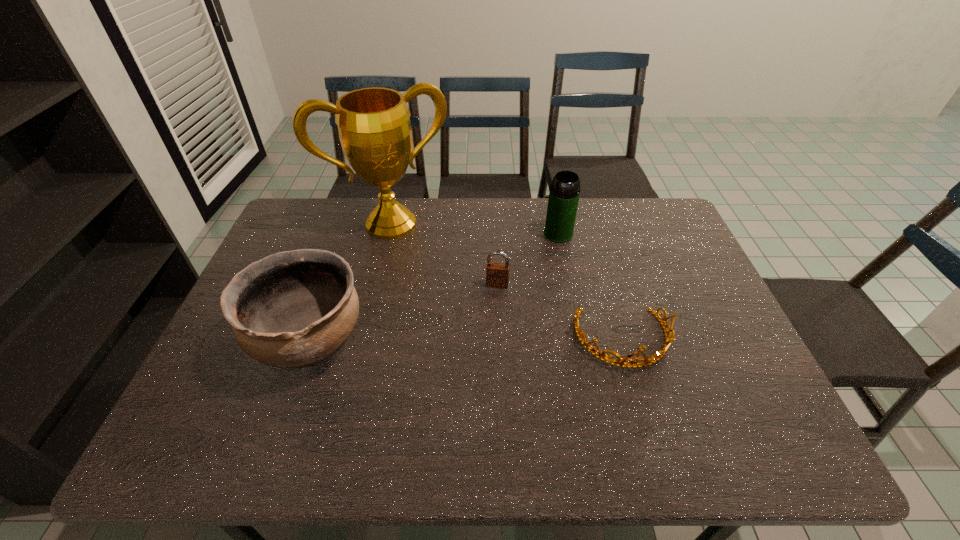
I want to click on vacant area situated from the spout of the second tallest object, so click(x=536, y=275).

Locate an element on the screen. The image size is (960, 540). vacant space located on the front-facing side of the award is located at coordinates (437, 296).

Locate an element on the screen. vacant region located 0.120m on the front-facing side of the award is located at coordinates [422, 265].

Where is `vacant space located on the front-facing side of the award`? vacant space located on the front-facing side of the award is located at coordinates point(436,294).

The width and height of the screenshot is (960, 540). I want to click on free space located 0.190m on the front-facing side of the padlock, so click(x=485, y=341).

This screenshot has width=960, height=540. What are the coordinates of `vacant region located on the front-facing side of the padlock` in the screenshot? It's located at (479, 370).

This screenshot has height=540, width=960. I want to click on free space located 0.380m on the front-facing side of the padlock, so click(472, 408).

Identify the location of thermos bottle present at the far edge. (564, 193).

Where is `award at the far edge`? award at the far edge is located at coordinates (374, 127).

Identify the location of object located in the near edge section of the desktop. This screenshot has width=960, height=540. (293, 309).